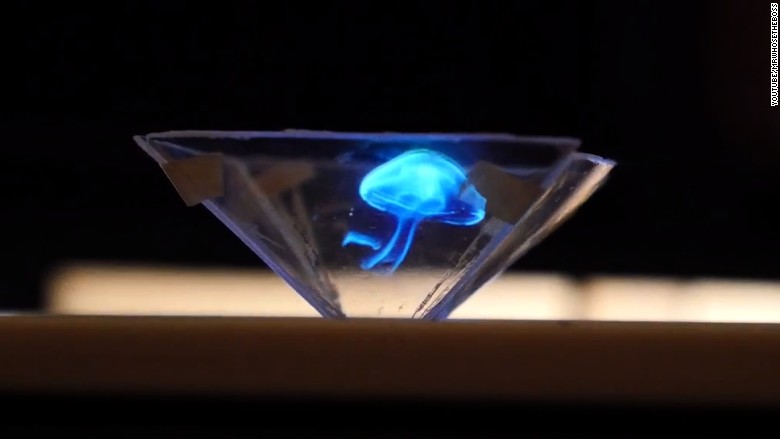
Locate an element on the screen. light is located at coordinates (406, 198).